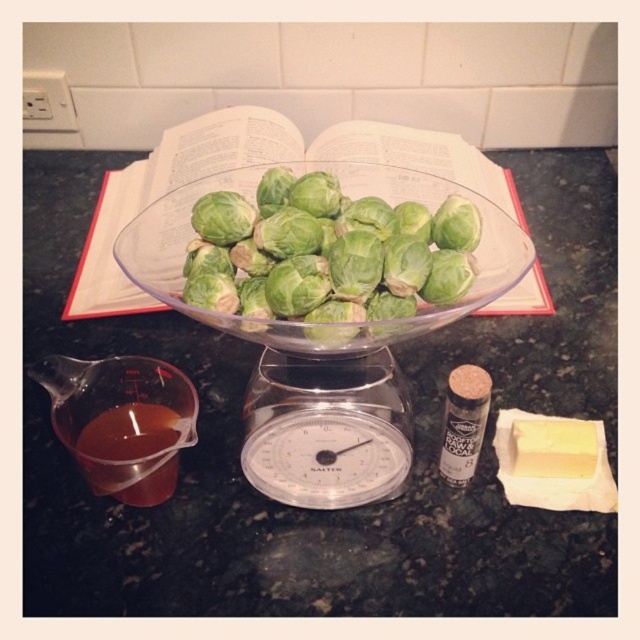
Between point (132, 435) and point (129, 442), which one is positioned behind?

The point (132, 435) is more distant.

Between point (132, 404) and point (161, 452), which one is positioned behind?

Positioned behind is point (132, 404).

Where is `translucent plastic measuring cup at lower left`? translucent plastic measuring cup at lower left is located at coordinates pyautogui.click(x=122, y=420).

Is point (200, 253) positioned after point (426, 288)?

Yes.

Is transparent glass bowl at center smaller than green leafy brussels sprouts at center?

No, transparent glass bowl at center is not smaller than green leafy brussels sprouts at center.

Based on the photo, who is more distant from viewer, [419,324] or [424,218]?

Point [424,218]

Image resolution: width=640 pixels, height=640 pixels. I want to click on transparent glass bowl at center, so click(x=332, y=320).

Between green leafy brussels sprouts at center and green paper at center, which one has more height?

Standing taller between the two is green paper at center.

Which is more to the right, green leafy brussels sprouts at center or green paper at center?

green leafy brussels sprouts at center

What do you see at coordinates (326, 252) in the screenshot? This screenshot has height=640, width=640. I see `green leafy brussels sprouts at center` at bounding box center [326, 252].

I want to click on green leafy brussels sprouts at center, so click(x=326, y=252).